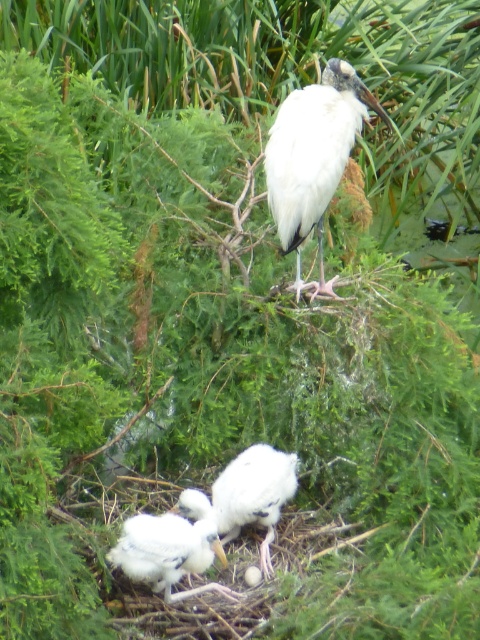
Between white fluffy bird at lower center and white fluffy bird at center, which one is positioned higher?

white fluffy bird at center

Does point (178, 570) lie in front of point (252, 460)?

Yes, point (178, 570) is closer to viewer.

The height and width of the screenshot is (640, 480). I want to click on white fluffy bird at lower center, so click(x=170, y=547).

Find the location of a particular element. Image resolution: width=480 pixels, height=640 pixels. white fluffy bird at lower center is located at coordinates (170, 547).

Between point (384, 115) and point (177, 556), which one is positioned in front?

Point (177, 556)

Between white smooth stork at center and white fluffy bird at lower center, which one has less height?

With less height is white fluffy bird at lower center.

The image size is (480, 640). What do you see at coordinates (313, 157) in the screenshot?
I see `white smooth stork at center` at bounding box center [313, 157].

Find the location of a particular element. white smooth stork at center is located at coordinates pyautogui.click(x=313, y=157).

Find the location of `white smooth stork at center`. white smooth stork at center is located at coordinates (313, 157).

Is point (339, 177) positioned in front of point (268, 490)?

No.

Image resolution: width=480 pixels, height=640 pixels. I want to click on white smooth stork at center, so click(313, 157).